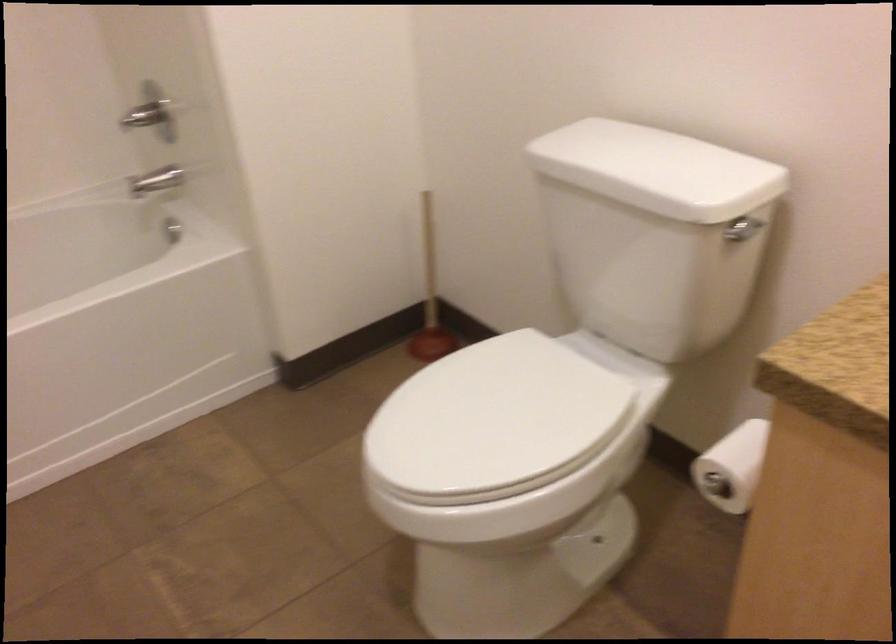
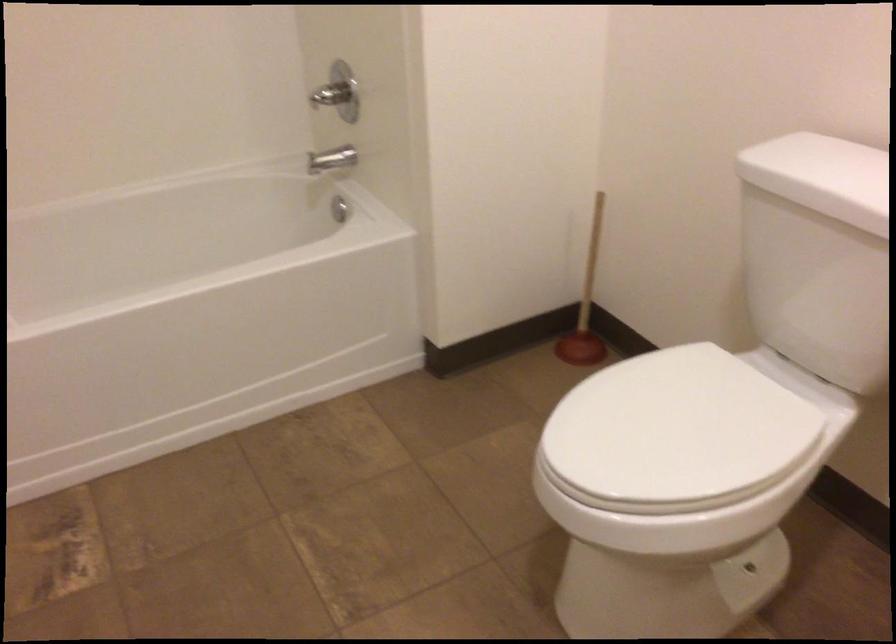
Locate, in the second image, the point that corresponds to pixel 431 303 in the first image.

(586, 305)